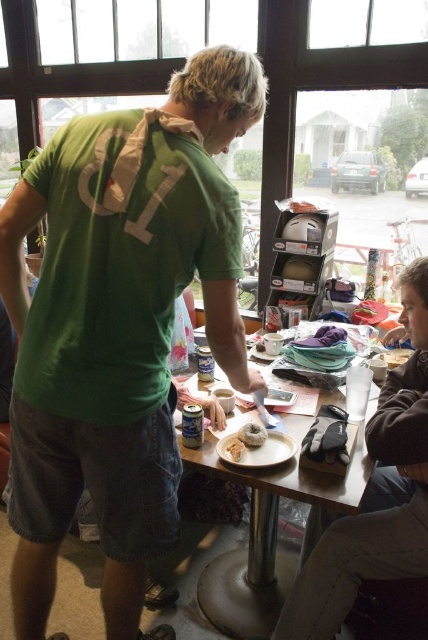
Question: Considering the real-world distances, which object is farthest from the soft white bread at table center?

Choices:
 (A) green matte t-shirt at center
 (B) white fluffy donut at center
 (C) wooden table at center
 (D) white matte plate at center

Answer: (C)

Question: Does brown fuzzy sweater at lower right appear over wooden table at center?

Choices:
 (A) no
 (B) yes

Answer: (B)

Question: Considering the real-world distances, which object is farthest from the green matte t-shirt at center?

Choices:
 (A) white fluffy donut at center
 (B) brown fuzzy sweater at lower right

Answer: (B)

Question: Which point is closer to the camera taking this photo?

Choices:
 (A) (121, 118)
 (B) (282, 449)

Answer: (A)

Question: Does brown fuzzy sweater at lower right have a lesser width compared to white matte plate at center?

Choices:
 (A) no
 (B) yes

Answer: (A)

Question: Considering the relative positions of brown fuzzy sweater at lower right and white matte plate at center in the image provided, where is brown fuzzy sweater at lower right located with respect to white matte plate at center?

Choices:
 (A) left
 (B) right

Answer: (B)